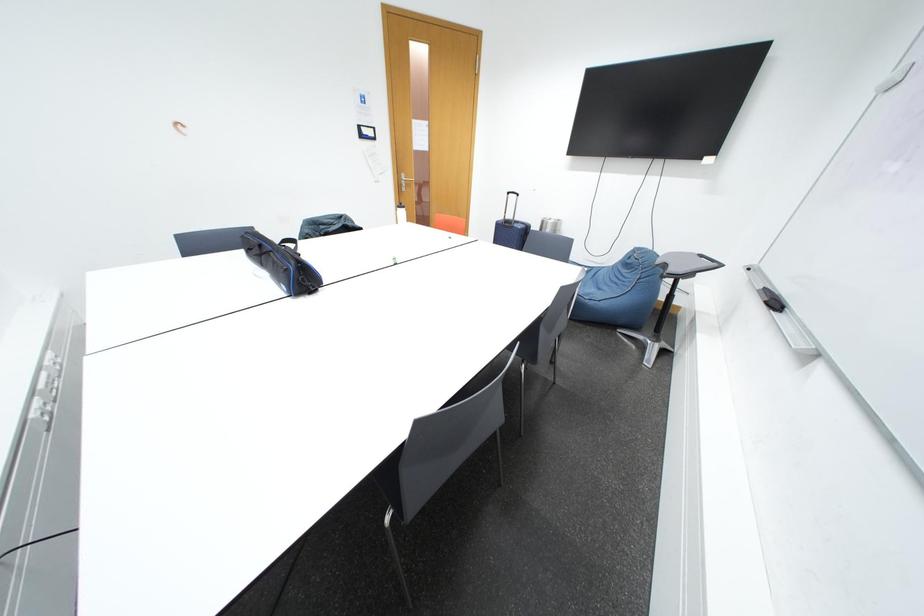
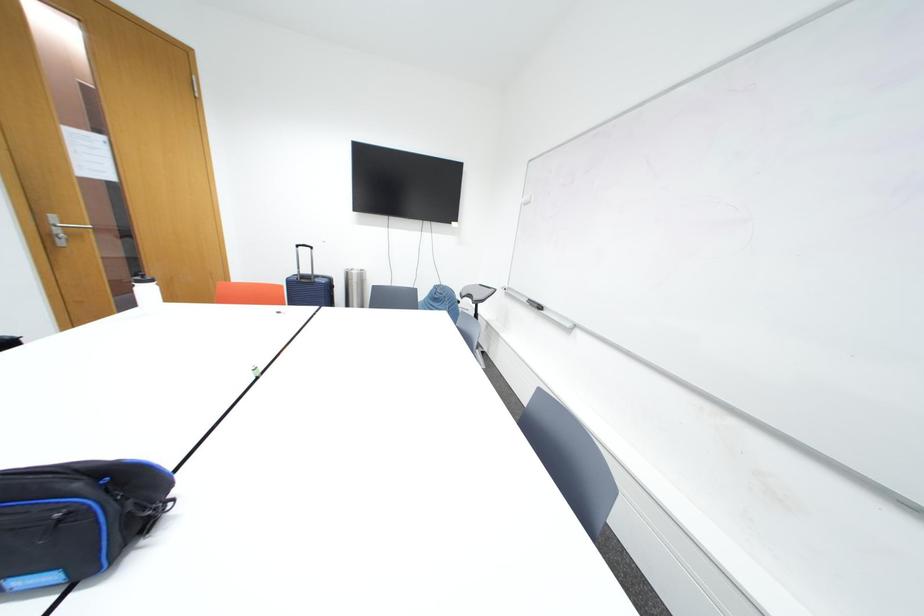
Question: How did the camera likely rotate?

Choices:
 (A) Left
 (B) Right
 (C) Up
 (D) Down

Answer: (B)